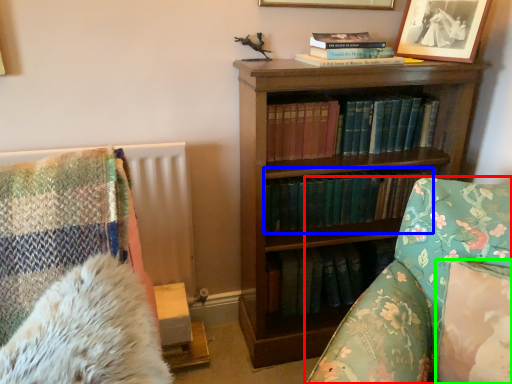
Question: Estimate the real-world distances between objects in this image. Which object is closer to furniture (highlighted by a red box), book (highlighted by a blue box) or pillow (highlighted by a green box)?

Choices:
 (A) book
 (B) pillow

Answer: (B)